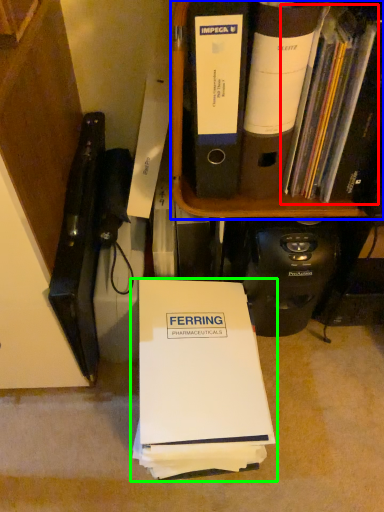
Question: Which object is positioned closest to book (highlighted by a red box)? Select from bookcase (highlighted by a blue box) and book (highlighted by a green box).

Choices:
 (A) bookcase
 (B) book

Answer: (A)